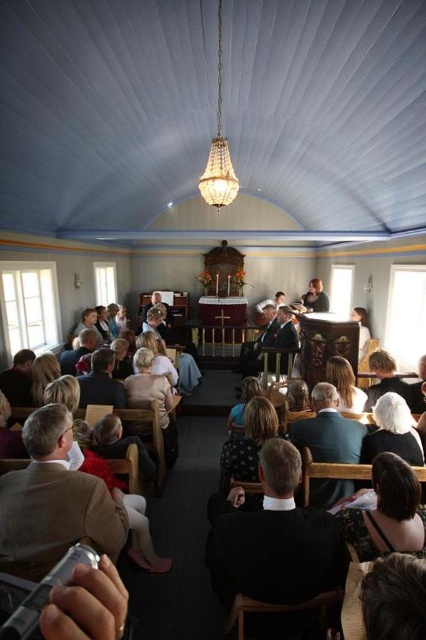
Which is in front, point (81, 378) or point (85, 330)?

Point (81, 378) is more forward.

Which is more to the left, dark brown leather jacket at center or light brown wooden chair at lower left?

light brown wooden chair at lower left is more to the left.

Between point (89, 394) and point (89, 346), which one is positioned behind?

Positioned behind is point (89, 346).

The image size is (426, 640). I want to click on dark brown leather jacket at center, so click(x=100, y=381).

Does brown leather jacket at lower left have a lesser height compared to dark brown hair at lower center?

Incorrect, brown leather jacket at lower left's height does not fall short of dark brown hair at lower center's.

Is the position of brown leather jacket at lower left more distant than that of dark brown hair at lower center?

Yes, it is behind dark brown hair at lower center.

The height and width of the screenshot is (640, 426). What do you see at coordinates (54, 500) in the screenshot?
I see `brown leather jacket at lower left` at bounding box center [54, 500].

I want to click on brown leather jacket at lower left, so click(x=54, y=500).

Does dark green suit at center have a smaller size compared to dark brown leather jacket at lower left?

Incorrect, dark green suit at center is not smaller in size than dark brown leather jacket at lower left.

Is dark green suit at center taller than dark brown leather jacket at lower left?

Yes, dark green suit at center is taller than dark brown leather jacket at lower left.

Is point (334, 435) positioned in front of point (11, 397)?

Yes.

Where is `dark green suit at center`? This screenshot has width=426, height=640. dark green suit at center is located at coordinates (328, 429).